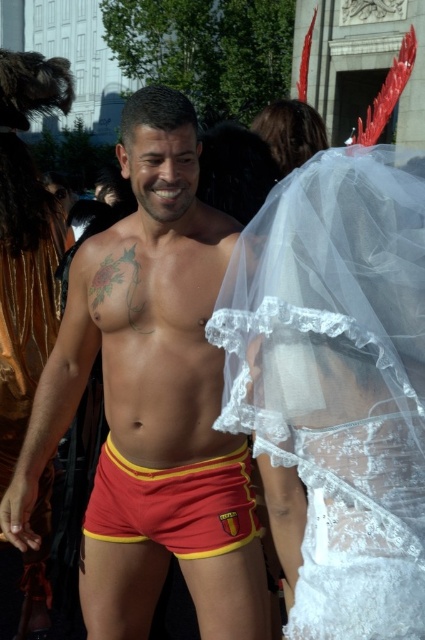
Question: Among these points, which one is nearest to the camera?

Choices:
 (A) (377, 257)
 (B) (240, 547)

Answer: (A)

Question: Does matte red shorts at center appear on the right side of red/yellow fabric shorts at center?

Choices:
 (A) yes
 (B) no

Answer: (B)

Question: Does white lace veil at upper center have a lesser width compared to matte red shorts at center?

Choices:
 (A) yes
 (B) no

Answer: (A)

Question: Which point appears farthest from the camera in this image?

Choices:
 (A) (96, 467)
 (B) (27, 477)
 (C) (288, 348)

Answer: (A)

Question: Among these points, which one is farthest from the camera?

Choices:
 (A) (218, 483)
 (B) (289, 442)
 (C) (113, 592)

Answer: (A)

Question: Is white lace veil at upper center further to camera compared to red/yellow fabric shorts at center?

Choices:
 (A) no
 (B) yes

Answer: (A)